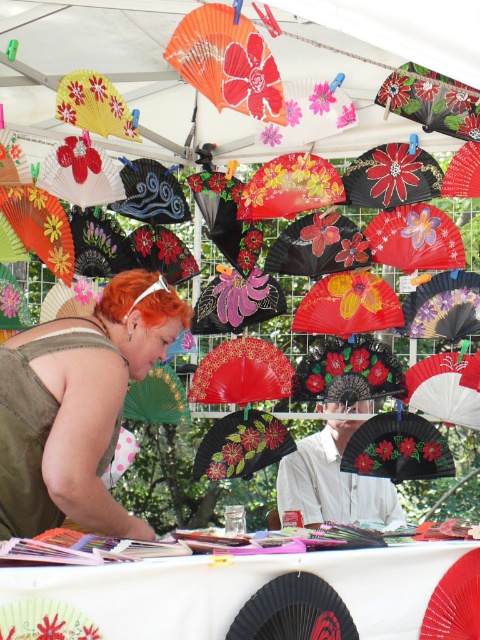
Question: Observing the image, what is the correct spatial positioning of matte olive green tank top at center in reference to black paper fan at center?

Choices:
 (A) above
 (B) below

Answer: (A)

Question: Can you confirm if matte black fan at center is positioned below black paper fan at center?

Choices:
 (A) no
 (B) yes

Answer: (A)

Question: Can you confirm if orange paper fan at upper center is thinner than black paper fan at center?

Choices:
 (A) no
 (B) yes

Answer: (B)

Question: Which point is closer to the camera taking this photo?

Choices:
 (A) (195, 588)
 (B) (6, 385)
 (C) (342, 499)
 (D) (431, 429)

Answer: (A)

Question: Among these points, which one is nearest to the camera?

Choices:
 (A) (392, 435)
 (B) (16, 522)

Answer: (B)

Question: Which object appears farthest from the camera in this image?

Choices:
 (A) white paper table at center
 (B) matte black fan at center
 (C) matte olive green tank top at center

Answer: (B)